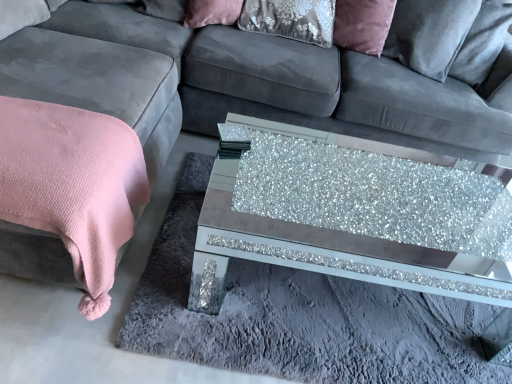
This screenshot has height=384, width=512. Describe the element at coordinates (339, 260) in the screenshot. I see `glittery glass coffee table at center` at that location.

You are a GUI agent. You are given a task and a screenshot of the screen. Output one action in this format:
    pyautogui.click(x=<x>, y=<y>)
    Task: Click on the glittery glass coffee table at center
    This screenshot has width=512, height=384.
    Given the screenshot: What is the action you would take?
    pyautogui.click(x=339, y=260)

Is velvet/matte pillow at upper center aimed at pink textured blanket at left?

No, velvet/matte pillow at upper center is not oriented towards pink textured blanket at left.

Considering the relative sizes of velvet/matte pillow at upper center and pink textured blanket at left in the image provided, is velvet/matte pillow at upper center smaller than pink textured blanket at left?

Indeed, velvet/matte pillow at upper center has a smaller size compared to pink textured blanket at left.

Considering the relative positions of velvet/matte pillow at upper center and pink textured blanket at left in the image provided, is velvet/matte pillow at upper center to the left of pink textured blanket at left from the viewer's perspective?

In fact, velvet/matte pillow at upper center is to the right of pink textured blanket at left.

Is pink textured blanket at left facing towards glittery glass coffee table at center?

No.

From a real-world perspective, which object rests below the other?

glittery glass coffee table at center, from a real-world perspective.

Which is farther from the camera, (x=99, y=244) or (x=260, y=247)?

The point (x=260, y=247) is more distant.

Is pink textured blanket at left taller than glittery glass coffee table at center?

Correct, pink textured blanket at left is much taller as glittery glass coffee table at center.

Is pink textured blanket at left surrounding velvet/matte pillow at upper center?

That's incorrect, velvet/matte pillow at upper center is not inside pink textured blanket at left.

Does pink textured blanket at left appear on the right side of velvet/matte pillow at upper center?

No.

Which object is further away from the camera, pink textured blanket at left or velvet/matte pillow at upper center?

velvet/matte pillow at upper center is further away from the camera.

Considering the positions of objects velvet/matte pillow at upper center and glittery glass coffee table at center in the image provided, who is more to the left, velvet/matte pillow at upper center or glittery glass coffee table at center?

velvet/matte pillow at upper center.

From a real-world perspective, is velvet/matte pillow at upper center under glittery glass coffee table at center?

No, from a real-world perspective, velvet/matte pillow at upper center is not beneath glittery glass coffee table at center.

From the image's perspective, is velvet/matte pillow at upper center on glittery glass coffee table at center?

Yes.

Where is `coffee table below the pink textured blanket at left (from a real-world perspective)`? coffee table below the pink textured blanket at left (from a real-world perspective) is located at coordinates (339, 260).

Can you confirm if glittery glass coffee table at center is smaller than pink textured blanket at left?

No, glittery glass coffee table at center is not smaller than pink textured blanket at left.

In terms of height, does glittery glass coffee table at center look taller or shorter compared to pink textured blanket at left?

Clearly, glittery glass coffee table at center is shorter compared to pink textured blanket at left.

Looking at this image, from a real-world perspective, which is physically above, glittery glass coffee table at center or pink textured blanket at left?

pink textured blanket at left is physically above.

Does glittery glass coffee table at center have a lesser height compared to velvet/matte pillow at upper center?

No.

Does glittery glass coffee table at center appear on the right side of velvet/matte pillow at upper center?

Correct, you'll find glittery glass coffee table at center to the right of velvet/matte pillow at upper center.

Between glittery glass coffee table at center and velvet/matte pillow at upper center, which one has larger width?

With larger width is glittery glass coffee table at center.

Find the location of `blanket on the left of velvet/matte pillow at upper center`. blanket on the left of velvet/matte pillow at upper center is located at coordinates (73, 185).

Image resolution: width=512 pixels, height=384 pixels. Identify the location of blanket that appears above the glittery glass coffee table at center (from the image's perspective). (73, 185).

From the picture: Looking at the image, which one is located further to pink textured blanket at left, glittery glass coffee table at center or velvet/matte pillow at upper center?

glittery glass coffee table at center is further to pink textured blanket at left.

Considering their positions, is velvet/matte pillow at upper center positioned further to glittery glass coffee table at center than pink textured blanket at left?

Based on the image, velvet/matte pillow at upper center appears to be further to glittery glass coffee table at center.

From the image, which object appears to be nearer to pink textured blanket at left, velvet/matte pillow at upper center or glittery glass coffee table at center?

velvet/matte pillow at upper center is positioned closer to the anchor pink textured blanket at left.

Estimate the real-world distances between objects in this image. Which object is closer to velvet/matte pillow at upper center, glittery glass coffee table at center or pink textured blanket at left?

Based on the image, pink textured blanket at left appears to be nearer to velvet/matte pillow at upper center.

Considering their positions, is pink textured blanket at left positioned further to glittery glass coffee table at center than velvet/matte pillow at upper center?

Among the two, velvet/matte pillow at upper center is located further to glittery glass coffee table at center.

When comparing their distances from velvet/matte pillow at upper center, does pink textured blanket at left or glittery glass coffee table at center seem closer?

pink textured blanket at left is closer to velvet/matte pillow at upper center.

You are a GUI agent. You are given a task and a screenshot of the screen. Output one action in this format:
    pyautogui.click(x=<x>, y=<y>)
    Task: Click on the blanket that lies between velvet/matte pillow at upper center and glittery glass coffee table at center from top to bottom
    
    Given the screenshot: What is the action you would take?
    pyautogui.click(x=73, y=185)